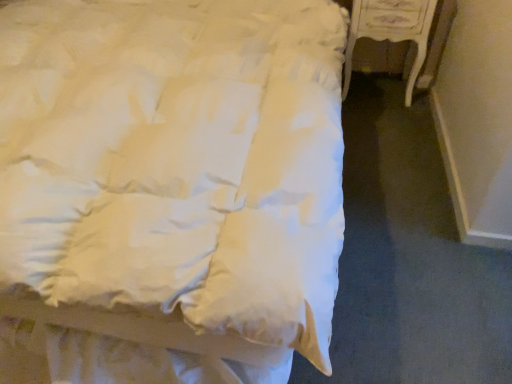
Question: Considering the relative positions of white satin bed at upper left and white glossy nightstand at right in the image provided, is white satin bed at upper left to the left of white glossy nightstand at right from the viewer's perspective?

Choices:
 (A) no
 (B) yes

Answer: (B)

Question: From the image's perspective, is white satin bed at upper left on white glossy nightstand at right?

Choices:
 (A) yes
 (B) no

Answer: (B)

Question: Is white satin bed at upper left oriented towards white glossy nightstand at right?

Choices:
 (A) no
 (B) yes

Answer: (A)

Question: From a real-world perspective, is white satin bed at upper left located higher than white glossy nightstand at right?

Choices:
 (A) no
 (B) yes

Answer: (B)

Question: From the image's perspective, is white satin bed at upper left under white glossy nightstand at right?

Choices:
 (A) no
 (B) yes

Answer: (B)

Question: From a real-world perspective, is white satin bed at upper left beneath white glossy nightstand at right?

Choices:
 (A) no
 (B) yes

Answer: (A)

Question: From the image's perspective, would you say white glossy nightstand at right is positioned over white satin bed at upper left?

Choices:
 (A) yes
 (B) no

Answer: (A)

Question: Can you confirm if white glossy nightstand at right is smaller than white satin bed at upper left?

Choices:
 (A) no
 (B) yes

Answer: (B)

Question: Is white glossy nightstand at right with white satin bed at upper left?

Choices:
 (A) no
 (B) yes

Answer: (A)

Question: Considering the relative sizes of white glossy nightstand at right and white satin bed at upper left in the image provided, is white glossy nightstand at right bigger than white satin bed at upper left?

Choices:
 (A) yes
 (B) no

Answer: (B)

Question: From a real-world perspective, does white glossy nightstand at right stand above white satin bed at upper left?

Choices:
 (A) no
 (B) yes

Answer: (A)

Question: Is white glossy nightstand at right further to camera compared to white satin bed at upper left?

Choices:
 (A) yes
 (B) no

Answer: (A)

Question: Is white satin bed at upper left situated inside white glossy nightstand at right or outside?

Choices:
 (A) inside
 (B) outside

Answer: (B)